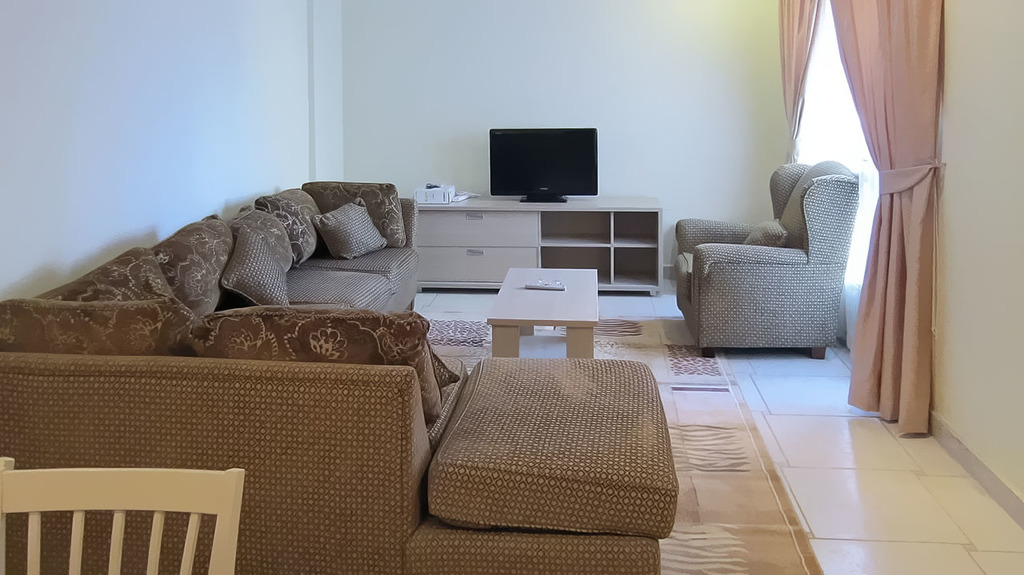
This screenshot has width=1024, height=575. Identify the location of tie backs. (911, 177), (791, 148).